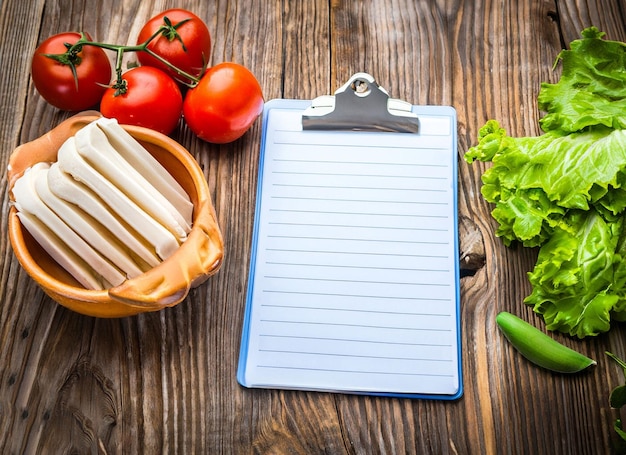
The width and height of the screenshot is (626, 455). What are the coordinates of `wood table` in the screenshot? It's located at (187, 362).